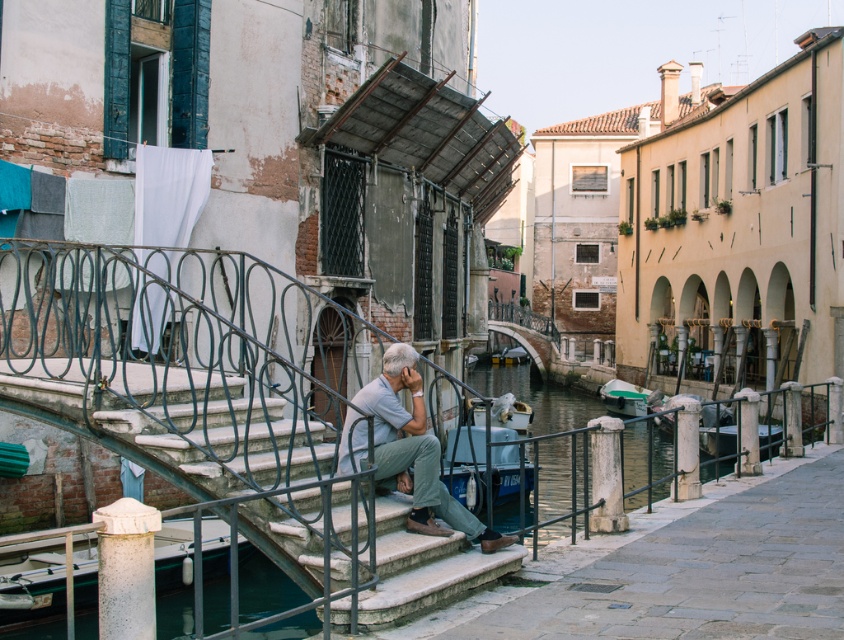
Question: Which object is closer to the camera taking this photo?

Choices:
 (A) smooth concrete stairs at center
 (B) green plastic boat at lower right
 (C) white stone boat at lower left
 (D) metallic gray railing at center

Answer: (D)

Question: Does smooth concrete stairs at center appear on the left side of green plastic boat at lower right?

Choices:
 (A) no
 (B) yes

Answer: (B)

Question: Which point is closer to the camera?

Choices:
 (A) green plastic boat at lower right
 (B) smooth concrete stairs at center

Answer: (B)

Question: From the image, what is the correct spatial relationship of smooth concrete stairs at center in relation to white stone boat at lower left?

Choices:
 (A) above
 (B) below

Answer: (A)

Question: Among these objects, which one is nearest to the camera?

Choices:
 (A) white stone boat at lower left
 (B) green plastic boat at lower right

Answer: (A)

Question: Considering the relative positions of smooth concrete stairs at center and light gray fabric pants at center in the image provided, where is smooth concrete stairs at center located with respect to light gray fabric pants at center?

Choices:
 (A) left
 (B) right

Answer: (A)